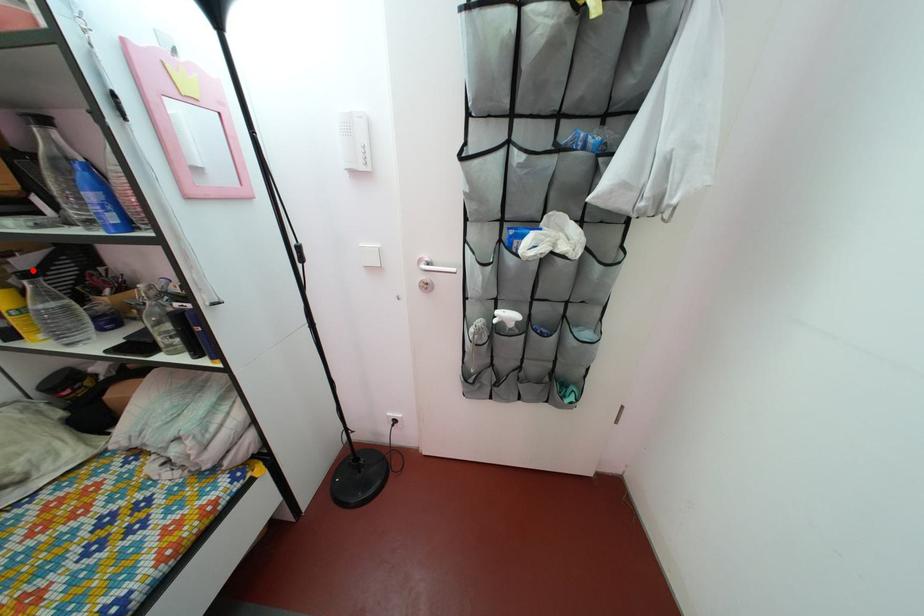
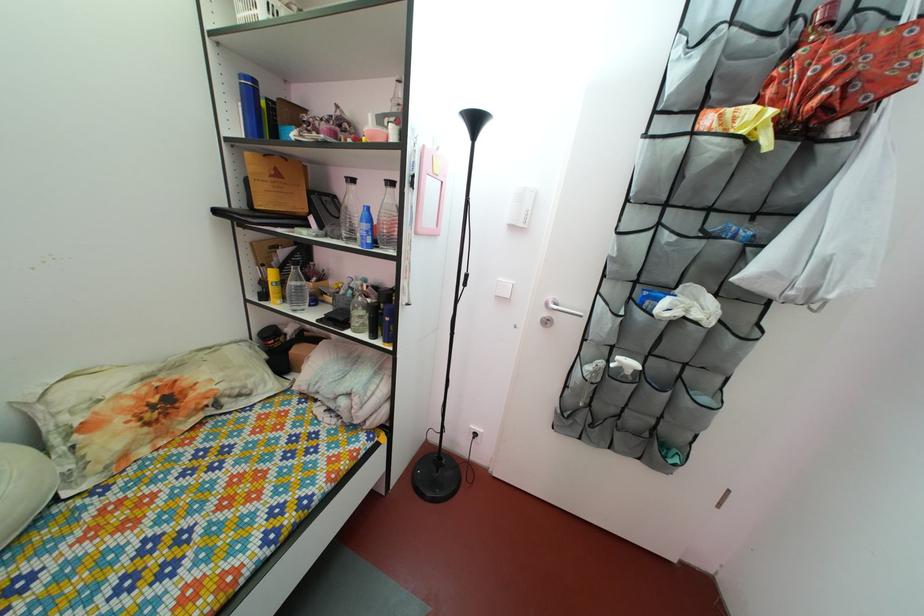
Question: I am providing you with two images of the same scene from different viewpoints. In image1, a red point is highlighted. Considering the same 3D point in image2, which of the following is correct?

Choices:
 (A) It is closer
 (B) It is farther

Answer: (A)